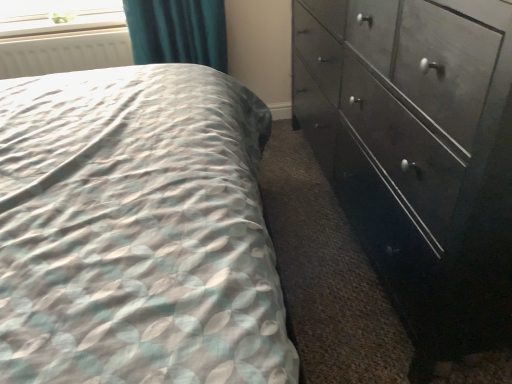
Question: From a real-world perspective, is dark wood dresser at right above or below white matte radiator at upper left?

Choices:
 (A) below
 (B) above

Answer: (A)

Question: In terms of width, does dark wood dresser at right look wider or thinner when compared to white matte radiator at upper left?

Choices:
 (A) thin
 (B) wide

Answer: (B)

Question: Which object is the farthest from the clear plastic window screen at upper left?

Choices:
 (A) white matte radiator at upper left
 (B) dark wood dresser at right

Answer: (B)

Question: Which object is positioned farthest from the dark wood dresser at right?

Choices:
 (A) clear plastic window screen at upper left
 (B) white matte radiator at upper left

Answer: (A)